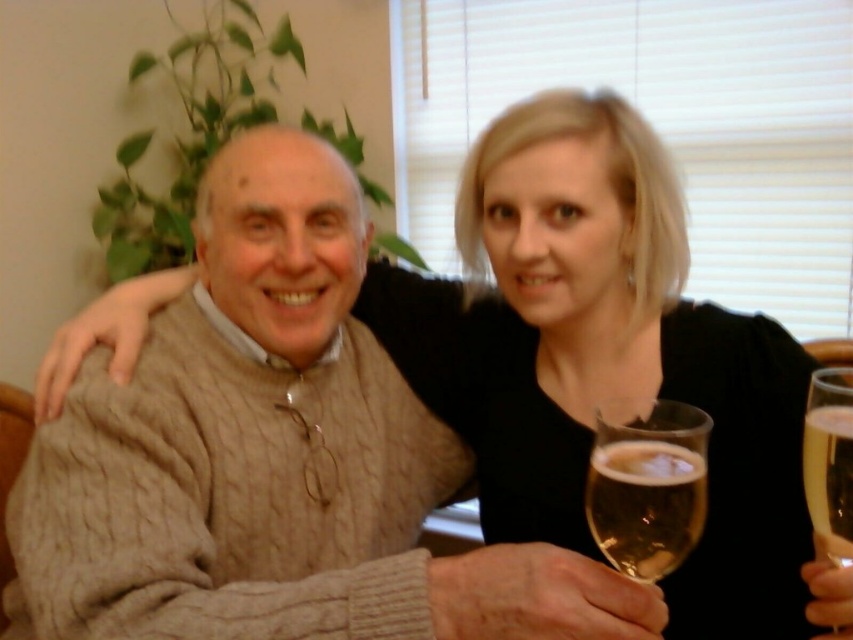
Question: Where is translucent glass at lower right located in relation to clear glass wine glass at right in the image?

Choices:
 (A) left
 (B) right

Answer: (A)

Question: Which point is farther to the camera?

Choices:
 (A) (599, 512)
 (B) (825, 436)

Answer: (A)

Question: Considering the relative positions of translucent glass at lower right and clear glass wine glass at right in the image provided, where is translucent glass at lower right located with respect to clear glass wine glass at right?

Choices:
 (A) below
 (B) above

Answer: (A)

Question: In this image, where is translucent glass at lower right located relative to clear glass wine glass at right?

Choices:
 (A) above
 (B) below

Answer: (B)